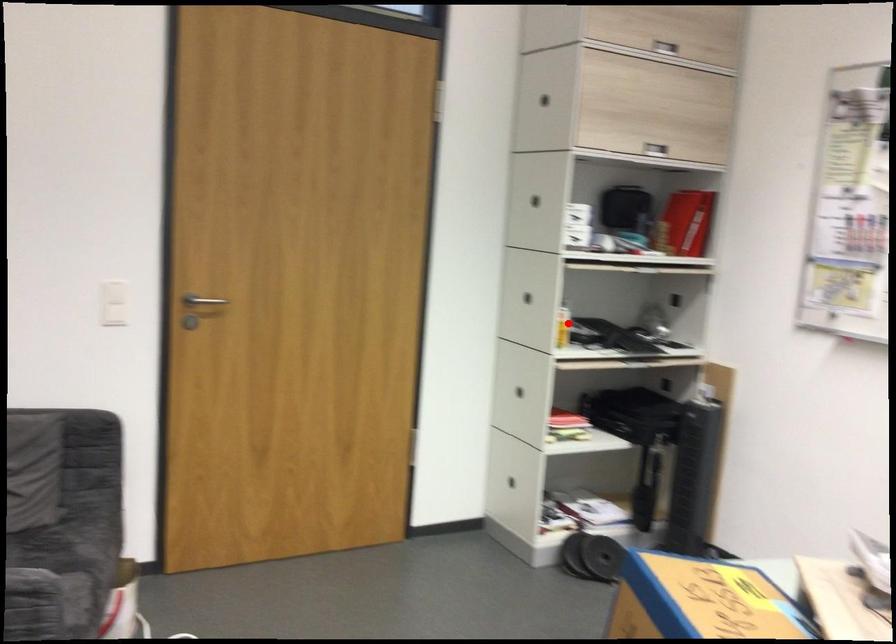
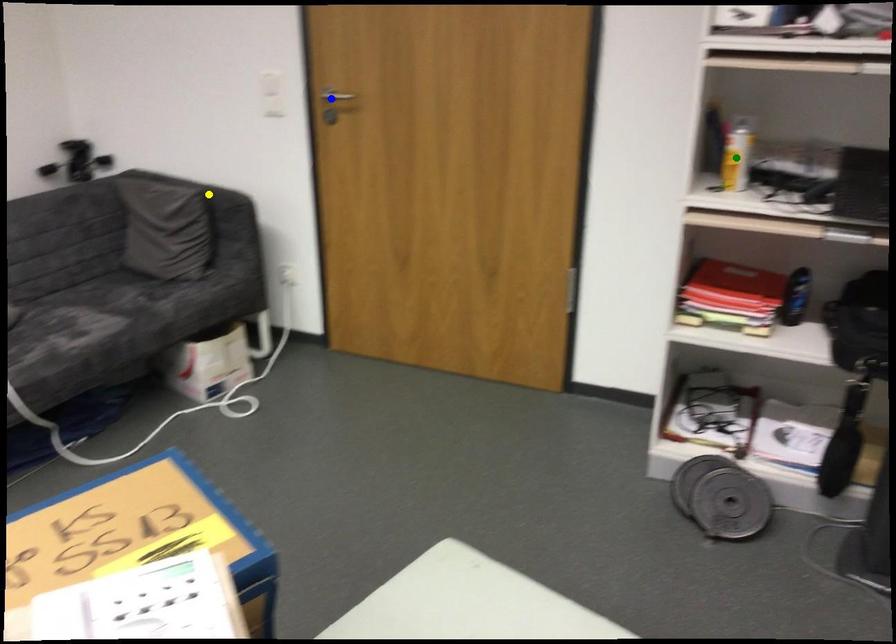
Question: I am providing you with two images of the same scene from different viewpoints. A red point is marked on the first image. You are given multiple points on the second image. Which point in image 2 is actually the same real-world point as the red point in image 1?

Choices:
 (A) blue point
 (B) yellow point
 (C) green point

Answer: (C)